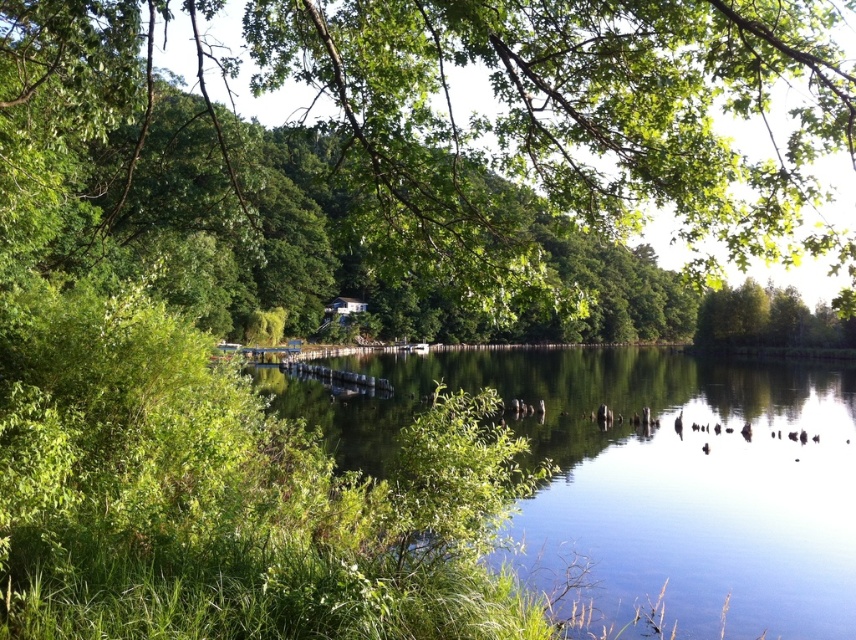
Based on the photo, is green leafy tree at upper center thinner than clear water at center?

Incorrect, green leafy tree at upper center's width is not less than clear water at center's.

You are a GUI agent. You are given a task and a screenshot of the screen. Output one action in this format:
    pyautogui.click(x=<x>, y=<y>)
    Task: Click on the green leafy tree at upper center
    This screenshot has height=640, width=856.
    Given the screenshot: What is the action you would take?
    pyautogui.click(x=418, y=141)

Is point (666, 86) in front of point (776, 417)?

Yes, point (666, 86) is in front of point (776, 417).

Identify the location of green leafy tree at upper center. The height and width of the screenshot is (640, 856). (418, 141).